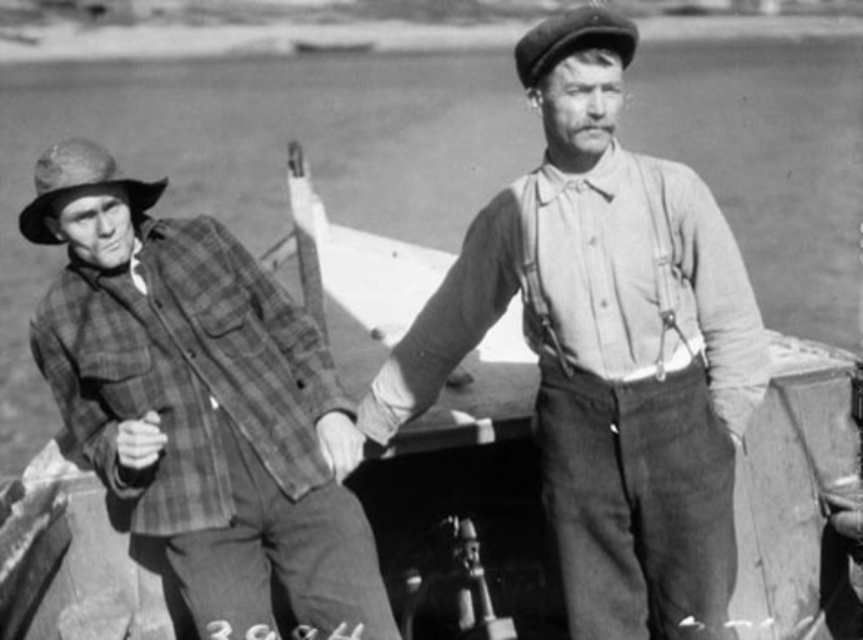
You are a photographer standing in front of the two men in the image. You want to take a closeup shot of the smooth cotton shirt at center without the plaid fabric shirt at left being in the frame. Is this possible given their positions?

The smooth cotton shirt at center is closer to the viewer than the plaid fabric shirt at left, so yes, you can take a closeup shot of the smooth cotton shirt at center without the plaid fabric shirt at left being in the frame because it is farther away.

You are a photographer trying to capture a group photo of the smooth cotton shirt at center and the plaid fabric shirt at left. If your camera has a minimum focus distance of 36 inches, will both shirts be in focus?

The smooth cotton shirt at center and plaid fabric shirt at left are 38.17 inches apart from each other. Since this distance exceeds the camera minimum focus distance of 36 inches, both shirts will be in focus.